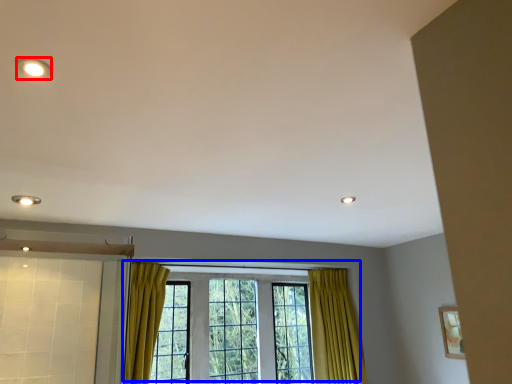
Question: Among these objects, which one is nearest to the camera, lighting (highlighted by a red box) or window (highlighted by a blue box)?

Choices:
 (A) lighting
 (B) window

Answer: (A)